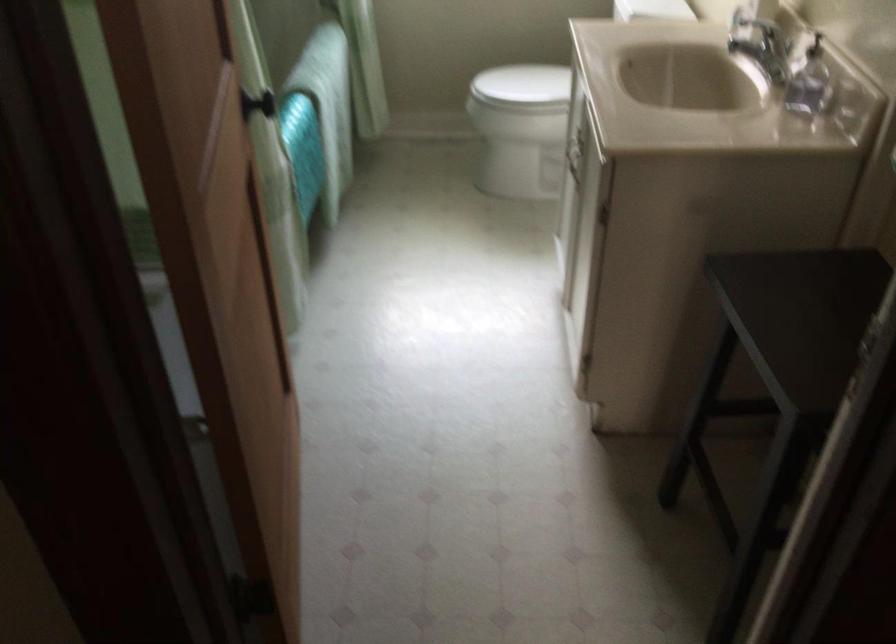
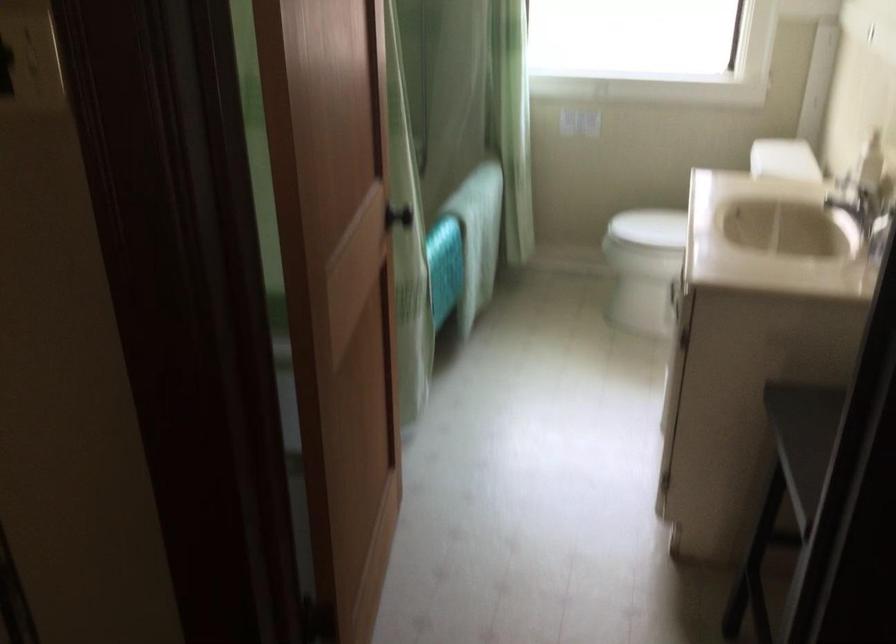
Where in the second image is the point corresponding to the point at 259,105 from the first image?

(397, 216)